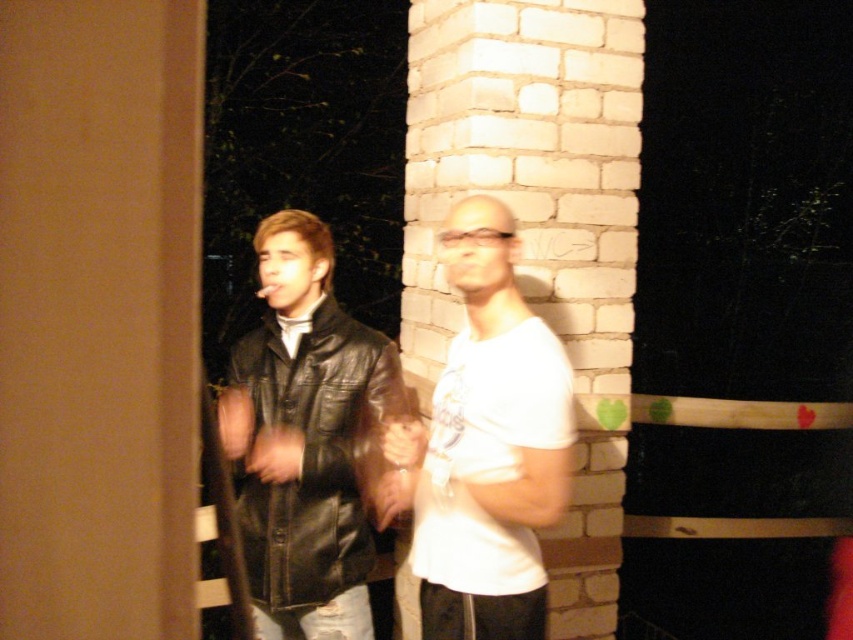
Question: Is white matte t-shirt at center to the left of black leather jacket at center from the viewer's perspective?

Choices:
 (A) no
 (B) yes

Answer: (A)

Question: Which object appears closest to the camera in this image?

Choices:
 (A) black leather jacket at center
 (B) white matte t-shirt at center

Answer: (B)

Question: Is white matte t-shirt at center to the left of black leather jacket at center from the viewer's perspective?

Choices:
 (A) no
 (B) yes

Answer: (A)

Question: Can you confirm if white matte t-shirt at center is thinner than black leather jacket at center?

Choices:
 (A) yes
 (B) no

Answer: (A)

Question: Which of the following is the closest to the observer?

Choices:
 (A) (428, 563)
 (B) (321, 532)

Answer: (A)

Question: Which object appears farthest from the camera in this image?

Choices:
 (A) black leather jacket at center
 (B) white matte t-shirt at center

Answer: (A)